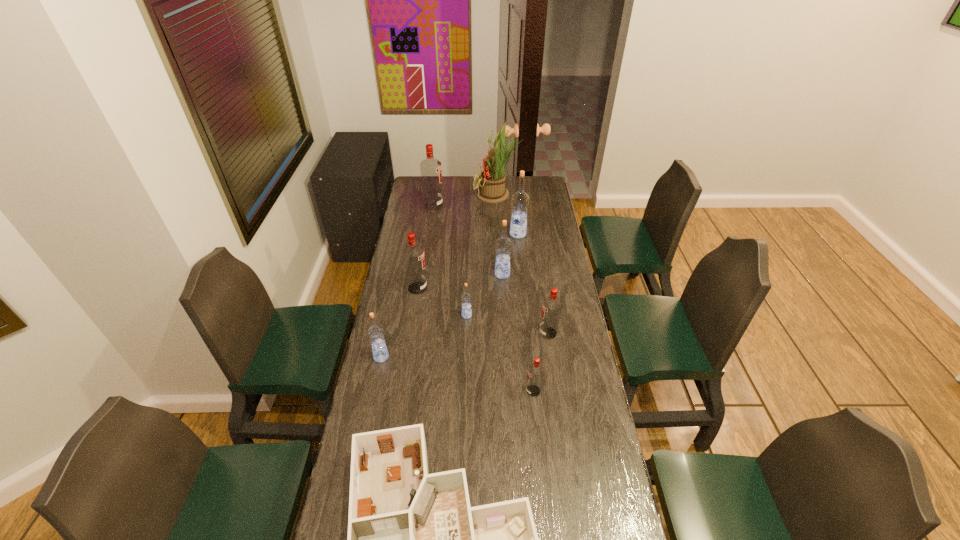
This screenshot has height=540, width=960. I want to click on vacant area that lies between the third smallest red vodka and the fourth vodka from left to right, so click(443, 302).

You are a GUI agent. You are given a task and a screenshot of the screen. Output one action in this format:
    pyautogui.click(x=<x>, y=<y>)
    Task: Click on the empty location between the farthest blue vodka and the sixth nearest object
    This screenshot has width=960, height=540.
    Given the screenshot: What is the action you would take?
    pyautogui.click(x=468, y=261)

The image size is (960, 540). I want to click on vacant area that lies between the biggest blue vodka and the tallest object, so pyautogui.click(x=507, y=214).

The width and height of the screenshot is (960, 540). Identify the location of free space between the biggest red vodka and the second smallest red vodka. (491, 269).

Locate an element on the screen. Image resolution: width=960 pixels, height=540 pixels. empty space that is in between the third blue vodka from right to left and the nearest vodka is located at coordinates (500, 353).

Image resolution: width=960 pixels, height=540 pixels. I want to click on unoccupied position between the second nearest vodka and the seventh farthest object, so click(x=465, y=345).

Choose which object is the eighth nearest neighbor to the sixth farthest object. Please provide its 2D coordinates. Your answer should be formatted as a tuple, i.e. [(x, y)], where the tuple contains the x and y coordinates of a point satisfying the conditions above.

[(431, 173)]

Find the location of `object that is the fourth nearest to the third nearest object`. object that is the fourth nearest to the third nearest object is located at coordinates (535, 371).

Select which vodka appears as the closest to the eighth nearest object. Please provide its 2D coordinates. Your answer should be formatted as a tuple, i.e. [(x, y)], where the tuple contains the x and y coordinates of a point satisfying the conditions above.

[(503, 245)]

Select which vodka appears as the fourth closest to the fourth vodka from left to right. Please provide its 2D coordinates. Your answer should be formatted as a tuple, i.e. [(x, y)], where the tuple contains the x and y coordinates of a point satisfying the conditions above.

[(375, 333)]